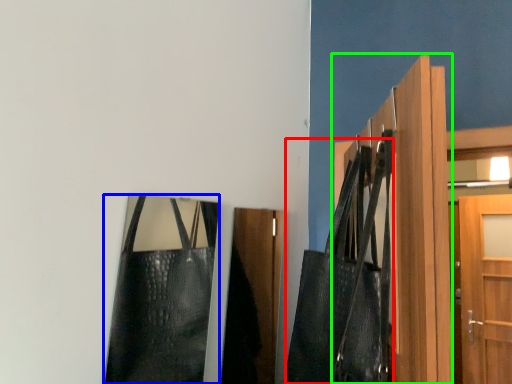
Question: Which is nearer to the shoulder bag (highlighted by a red box)? bag (highlighted by a blue box) or door (highlighted by a green box).

Choices:
 (A) bag
 (B) door

Answer: (B)